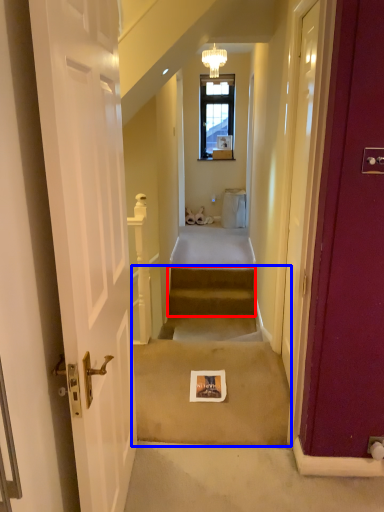
Question: Among these objects, which one is nearest to the camera, stairs (highlighted by a red box) or stairwell (highlighted by a blue box)?

Choices:
 (A) stairs
 (B) stairwell

Answer: (B)